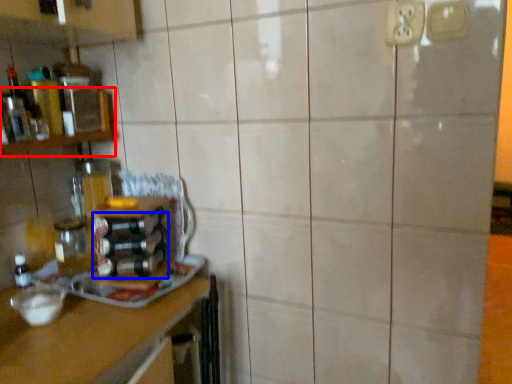
Question: Among these objects, which one is nearest to the camera, shelf (highlighted by a red box) or bottle (highlighted by a blue box)?

Choices:
 (A) shelf
 (B) bottle

Answer: (A)